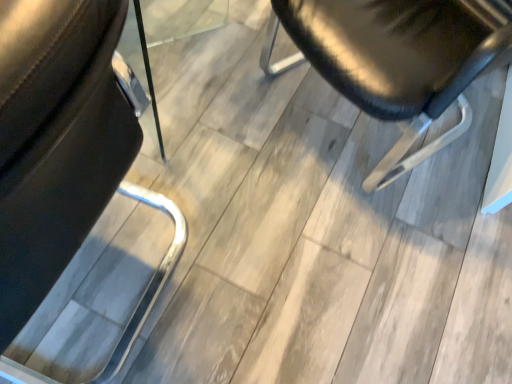
Question: Would you say black leather chair at left, placed as the 1th chair when sorted from left to right, is to the left or to the right of shiny black chair at center, which appears as the first chair when viewed from the right, in the picture?

Choices:
 (A) right
 (B) left

Answer: (B)

Question: In terms of width, does black leather chair at left, placed as the 1th chair when sorted from left to right, look wider or thinner when compared to shiny black chair at center, which is counted as the second chair, starting from the left?

Choices:
 (A) wide
 (B) thin

Answer: (B)

Question: From the image's perspective, relative to shiny black chair at center, which is counted as the second chair, starting from the left, is black leather chair at left, arranged as the second chair when viewed from the right, above or below?

Choices:
 (A) above
 (B) below

Answer: (B)

Question: Is shiny black chair at center, which appears as the first chair when viewed from the right, in front of or behind black leather chair at left, arranged as the second chair when viewed from the right, in the image?

Choices:
 (A) behind
 (B) front

Answer: (A)

Question: From the image's perspective, is shiny black chair at center, which is counted as the second chair, starting from the left, located above or below black leather chair at left, arranged as the second chair when viewed from the right?

Choices:
 (A) below
 (B) above

Answer: (B)

Question: Is point (449, 49) closer or farther from the camera than point (27, 288)?

Choices:
 (A) closer
 (B) farther

Answer: (B)

Question: From a real-world perspective, is shiny black chair at center, which is counted as the second chair, starting from the left, positioned above or below black leather chair at left, arranged as the second chair when viewed from the right?

Choices:
 (A) above
 (B) below

Answer: (B)